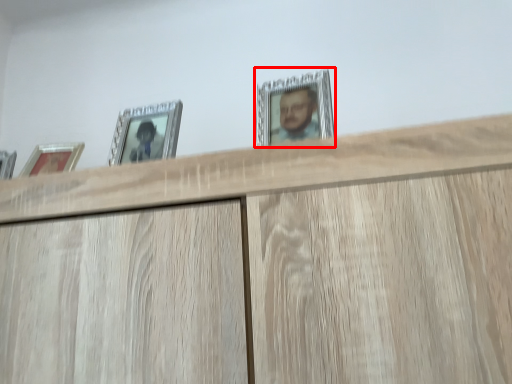
Question: Considering the relative positions of picture frame (annotated by the red box) and picture frame in the image provided, where is picture frame (annotated by the red box) located with respect to the staircase?

Choices:
 (A) right
 (B) left

Answer: (A)